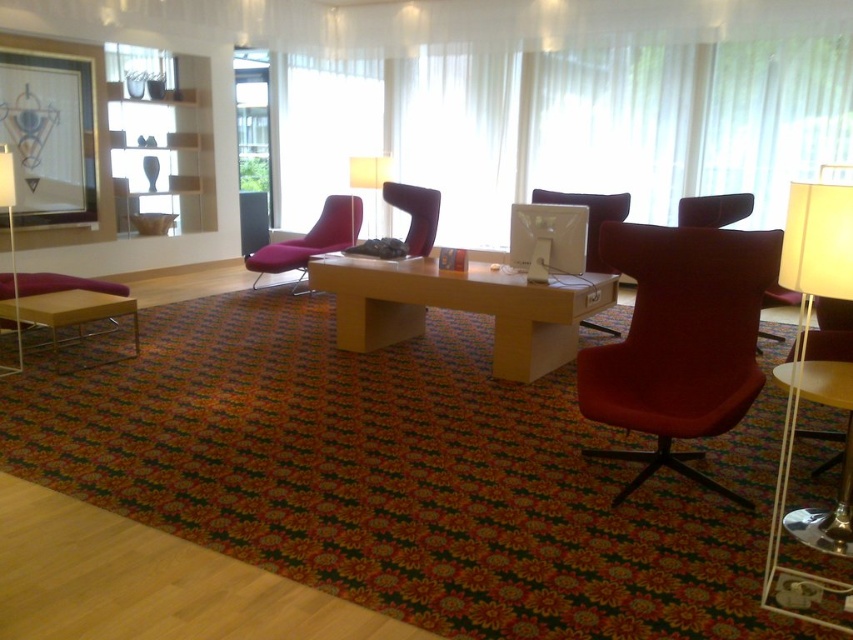
Does satin red swivel chair at center have a smaller size compared to white fabric lampshade at left?

No, satin red swivel chair at center is not smaller than white fabric lampshade at left.

Is point (717, 253) more distant than point (20, 330)?

No, (717, 253) is in front of (20, 330).

You are a GUI agent. You are given a task and a screenshot of the screen. Output one action in this format:
    pyautogui.click(x=<x>, y=<y>)
    Task: Click on the satin red swivel chair at center
    The width and height of the screenshot is (853, 640).
    Given the screenshot: What is the action you would take?
    pyautogui.click(x=679, y=340)

Is velvet red chair at center behind white fabric lampshade at left?

Yes, it is.

In the scene shown: Measure the distance from velvet red chair at center to white fabric lampshade at left.

They are 3.82 meters apart.

Where is `velvet red chair at center`? The image size is (853, 640). velvet red chair at center is located at coordinates (589, 216).

Does point (511, 208) come behind point (352, 218)?

No, (511, 208) is closer to viewer.

Identify the location of white glossy monitor at center. (547, 240).